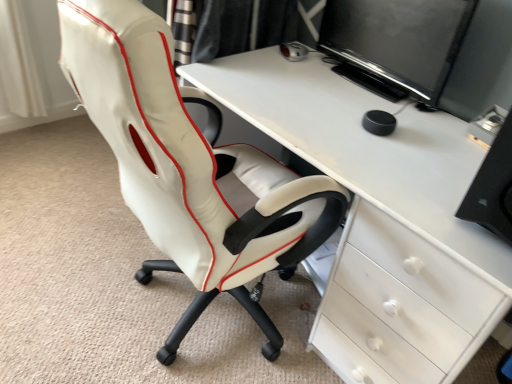
You are a GUI agent. You are given a task and a screenshot of the screen. Output one action in this format:
    pyautogui.click(x=<x>, y=<y>)
    Task: Click on the vacant point to the left of black plastic computer tower at right
    The width and height of the screenshot is (512, 384).
    Given the screenshot: What is the action you would take?
    pyautogui.click(x=417, y=185)